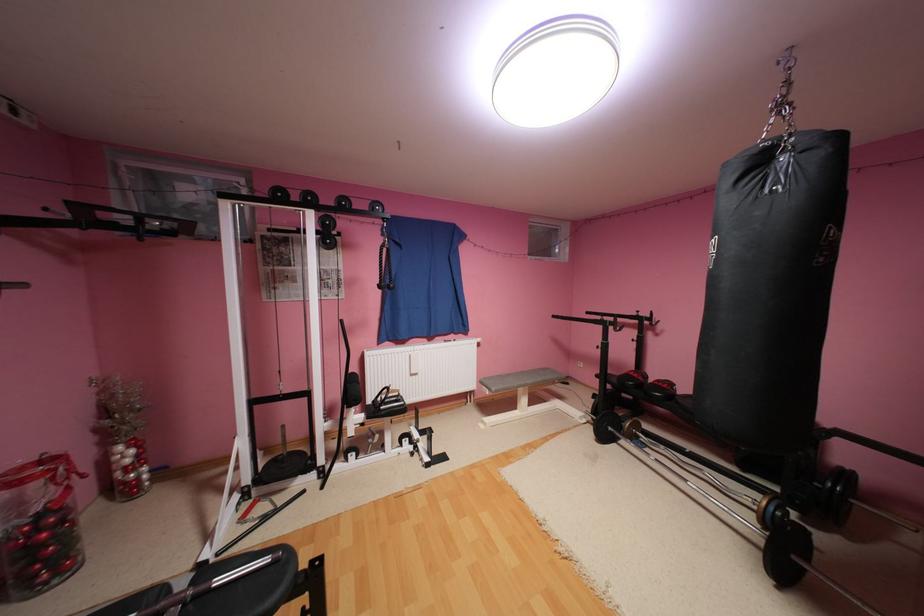
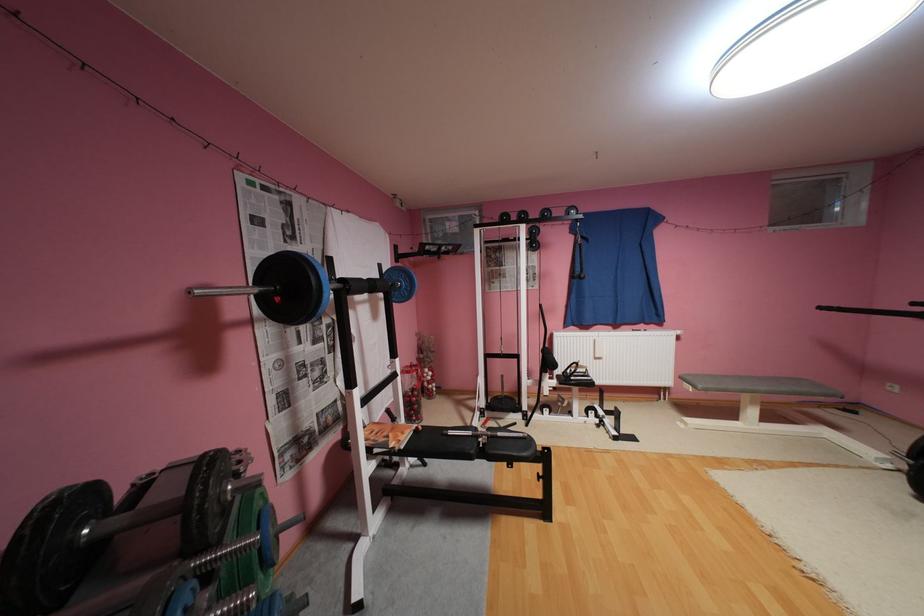
Where in the second image is the point corresponding to (538,382) from the first image?

(771, 387)